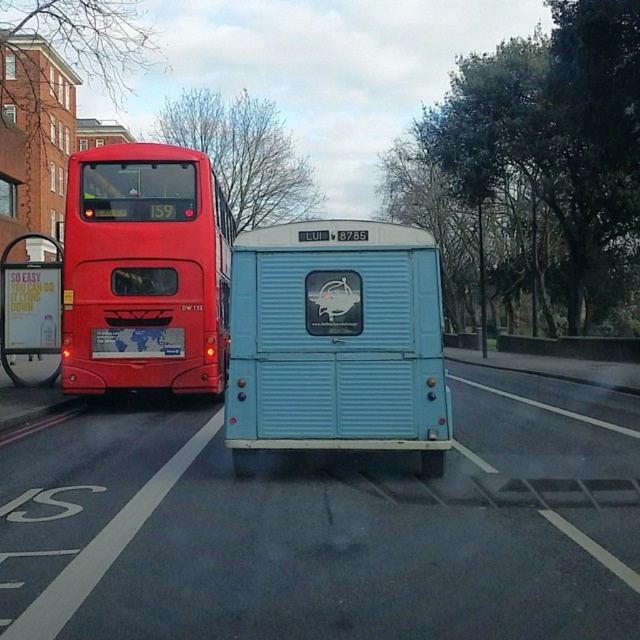
Question: Is light blue corrugated metal bus at center bigger than white plastic sign at left?

Choices:
 (A) no
 (B) yes

Answer: (A)

Question: Which point appears closest to the camera in this image?

Choices:
 (A) (99, 333)
 (B) (196, 387)
 (C) (0, 317)
 (D) (307, 248)

Answer: (D)

Question: Which is farther from the white plastic sign at left?

Choices:
 (A) matte red bus at left
 (B) white plastic license plate at rear center
 (C) light blue corrugated metal bus at center

Answer: (C)

Question: In this image, where is light blue corrugated metal bus at center located relative to white plastic sign at left?

Choices:
 (A) above
 (B) below

Answer: (B)

Question: Does light blue corrugated metal bus at center have a larger size compared to white plastic license plate at rear center?

Choices:
 (A) yes
 (B) no

Answer: (A)

Question: Which point is closer to the camera?

Choices:
 (A) (1, 342)
 (B) (161, 337)
 (C) (189, 328)

Answer: (B)